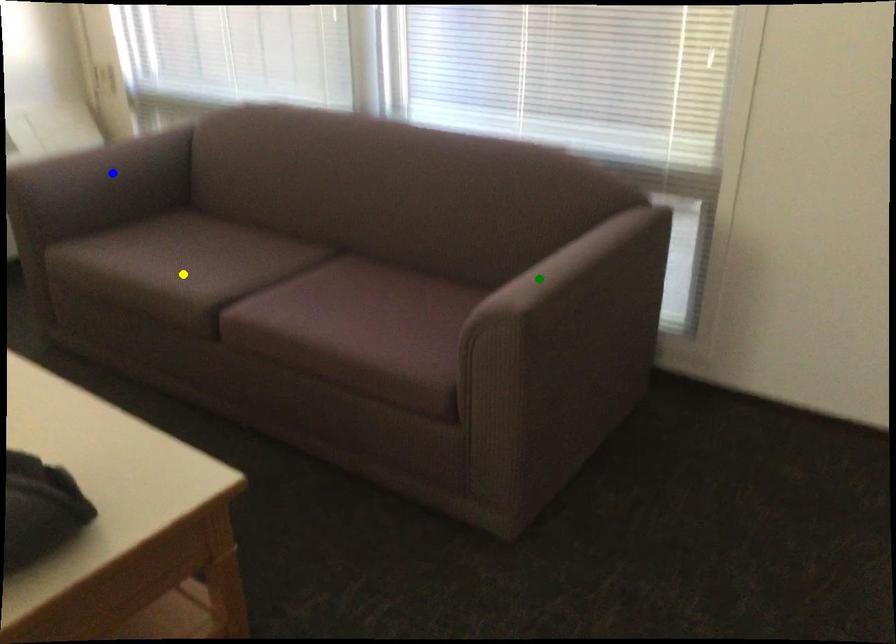
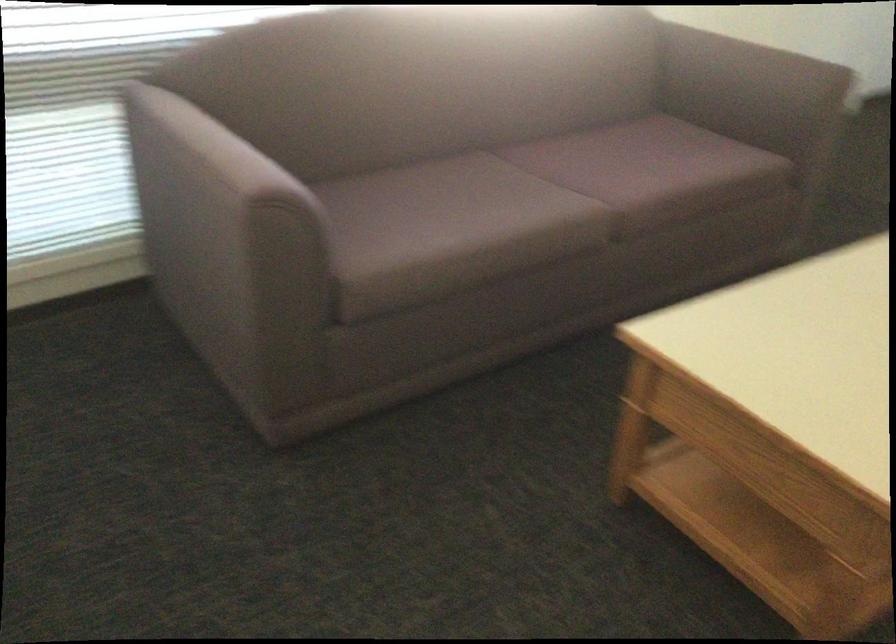
I am providing you with two images of the same scene from different viewpoints. Three points are marked in image1. Which point corresponds to a part or object that is occluded in image2?In image1, three points are marked. Which of them correspond to a part or object that is occluded in image2?Among the three points shown in image1, which one corresponds to a part or object that is no longer visible due to occlusion in image2?

Invisible in image2: blue point.